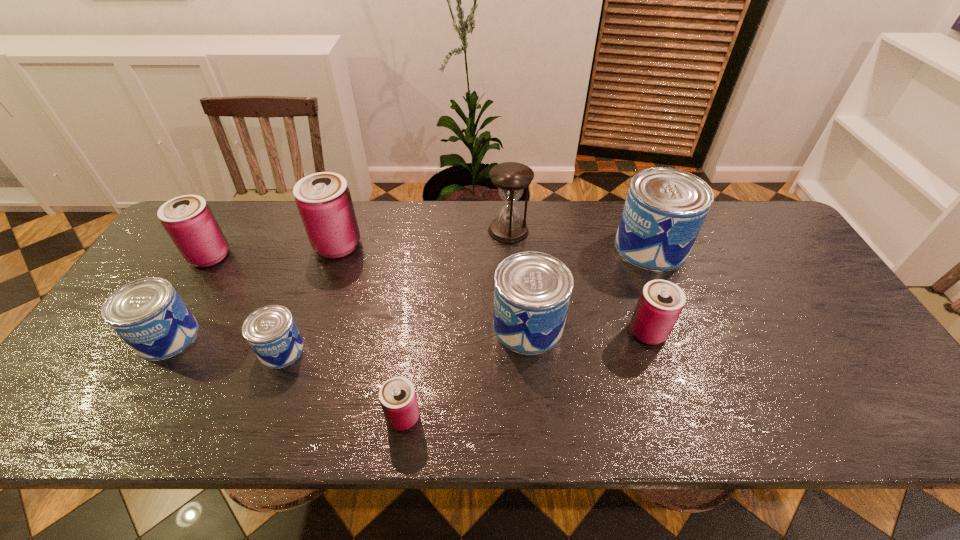
Identify the location of vacant space located on the front label of the sixth can from left to right. (443, 326).

Locate an element on the screen. This screenshot has height=540, width=960. vacant space located 0.370m on the front label of the sixth can from left to right is located at coordinates (348, 326).

Find the location of a particular element. The height and width of the screenshot is (540, 960). vacant space positioned 0.110m on the right of the rightmost pink can is located at coordinates (710, 332).

Where is `vacant space situated 0.090m on the front label of the leftmost blue can`? Image resolution: width=960 pixels, height=540 pixels. vacant space situated 0.090m on the front label of the leftmost blue can is located at coordinates (132, 395).

The height and width of the screenshot is (540, 960). I want to click on vacant space situated on the right of the fifth can from left to right, so click(x=600, y=417).

Locate an element on the screen. Image resolution: width=960 pixels, height=540 pixels. vacant space located 0.100m on the front label of the smallest blue can is located at coordinates 260,408.

Locate an element on the screen. hourglass that is at the far edge is located at coordinates (511, 178).

Find the location of `object present at the near edge`. object present at the near edge is located at coordinates (397, 395).

At what (x,y) coordinates should I click in order to perform the action: click on object at the far left corner. Please return your answer as a coordinate pair (x, y). The image size is (960, 540). Looking at the image, I should click on (188, 220).

This screenshot has height=540, width=960. In the image, there is a desktop. Identify the location of vacant region at the far edge. (292, 211).